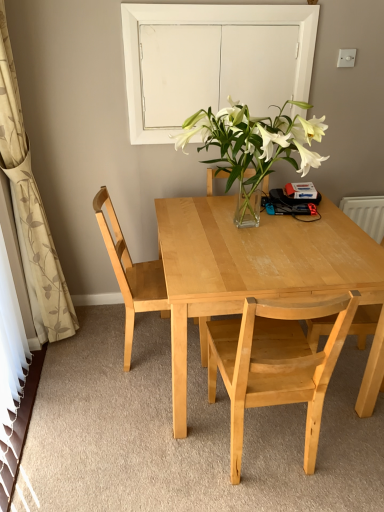
Where is `free region under light wood chair at center, arranged as the second chair when viewed from the left (from a real-world perspective)`? free region under light wood chair at center, arranged as the second chair when viewed from the left (from a real-world perspective) is located at coordinates (272, 456).